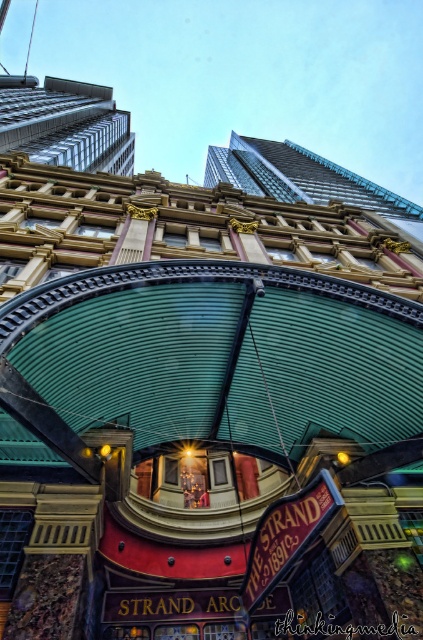
You are standing at the entrance of The Strand Arcade and want to locate two specific points marked on a map. The first point is at coordinates point (71, 90) and the second is at point (277, 170). According to the map, which point is closer to you when you are facing the entrance?

Point (277, 170) is closer to you because it is in front of point (71, 90), which is behind it.

You are standing at the entrance of The Strand Arcade and looking up. You notice a glassy steel skyscraper at upper left and a green corrugated metal canopy at upper center. Which object appears taller in the scene?

The green corrugated metal canopy at upper center appears taller than the glassy steel skyscraper at upper left because the skyscraper is shorter than the canopy according to the description.